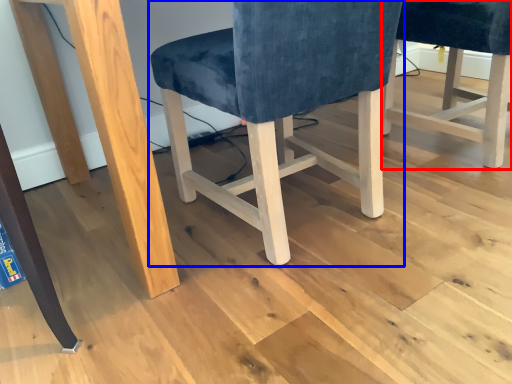
Question: Which object appears farthest to the camera in this image, chair (highlighted by a red box) or chair (highlighted by a blue box)?

Choices:
 (A) chair
 (B) chair

Answer: (A)